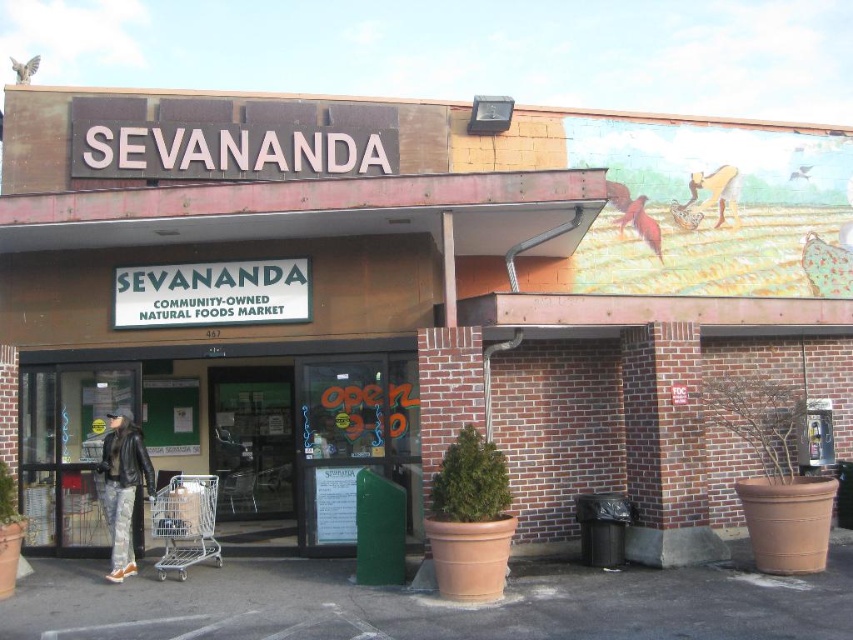
Question: Estimate the real-world distances between objects in this image. Which object is closer to the leather jacket at lower left?

Choices:
 (A) silver metallic shopping cart at lower left
 (B) metallic shopping cart at center
 (C) clear glass door at center

Answer: (A)

Question: Which is farther from the leather jacket at lower left?

Choices:
 (A) silver metallic shopping cart at lower left
 (B) metallic shopping cart at center

Answer: (B)

Question: Does metallic shopping cart at center have a greater width compared to leather jacket at lower left?

Choices:
 (A) yes
 (B) no

Answer: (A)

Question: Does metallic shopping cart at center appear on the right side of silver metallic shopping cart at lower left?

Choices:
 (A) yes
 (B) no

Answer: (B)

Question: Which point is farther from the camera taking this photo?

Choices:
 (A) (170, 563)
 (B) (328, 541)
 (C) (259, 392)

Answer: (C)

Question: Does metallic shopping cart at center have a larger size compared to silver metallic shopping cart at lower left?

Choices:
 (A) yes
 (B) no

Answer: (A)